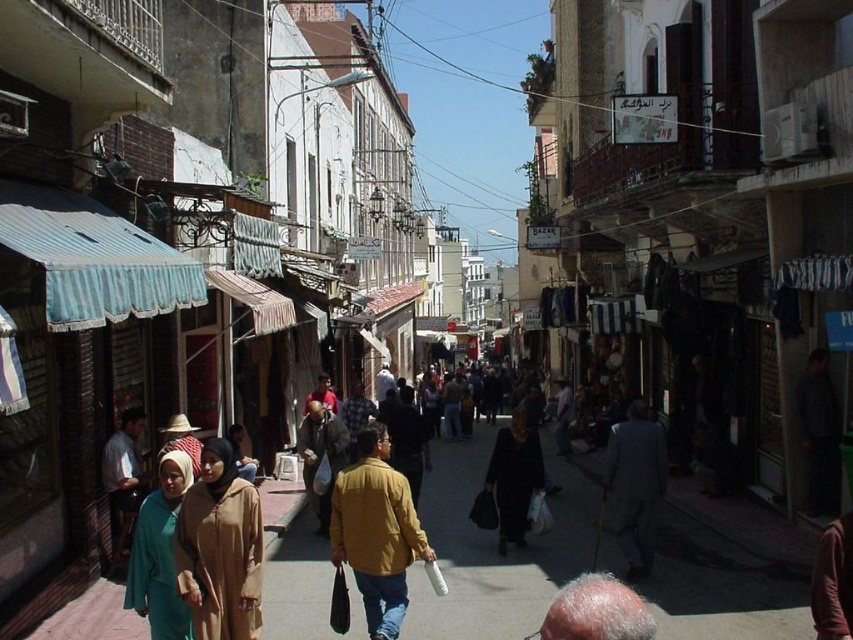
Consider the image. You are a fashion designer observing the street scene. You notice two individuals wearing the matte beige abaya at center and the dark gray suit at center. Which clothing item is shorter in length?

The matte beige abaya at center is shorter than the dark gray suit at center.

You are a photographer trying to capture both the matte beige abaya at center and the dark gray suit at center in a single frame. Given their sizes, which one will appear closer to the camera in the photo?

The matte beige abaya at center is smaller than the dark gray suit at center, so in the photo, the dark gray suit at center will appear closer to the camera because larger objects in the same frame typically appear nearer.

You are a photographer trying to capture the scene from the street level. You notice a person with gray hair at lower center and another wearing a black matte dress at center. Which of these two has a narrower visual presence in the frame?

The gray hair at lower center has a lesser width compared to the black matte dress at center, so the gray hair at lower center has a narrower visual presence in the frame.